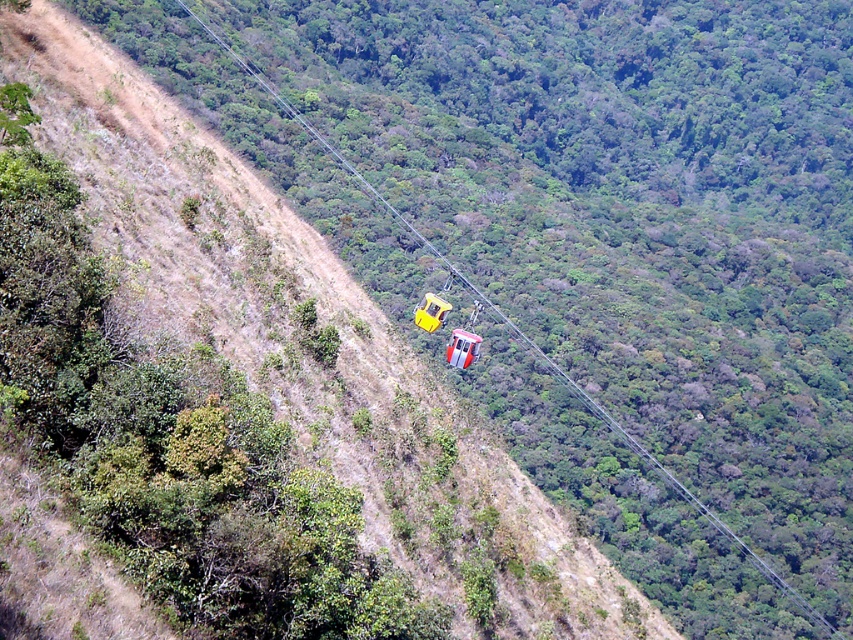
Does yellow matte parachute at center lie behind yellow matte cable car at center?

No, yellow matte parachute at center is closer to the viewer.

Is yellow matte parachute at center wider than yellow matte cable car at center?

No.

Identify the location of yellow matte parachute at center. The height and width of the screenshot is (640, 853). (462, 348).